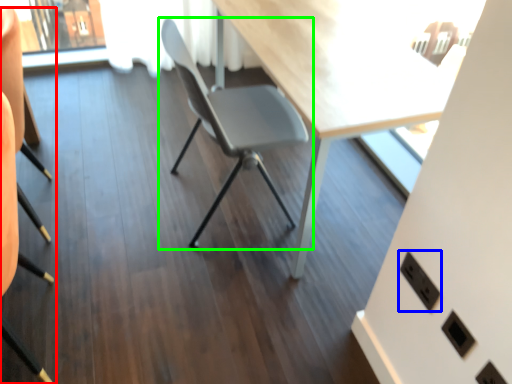
Question: Which is farther away from chair (highlighted by a red box)? electric outlet (highlighted by a blue box) or chair (highlighted by a green box)?

Choices:
 (A) electric outlet
 (B) chair

Answer: (A)